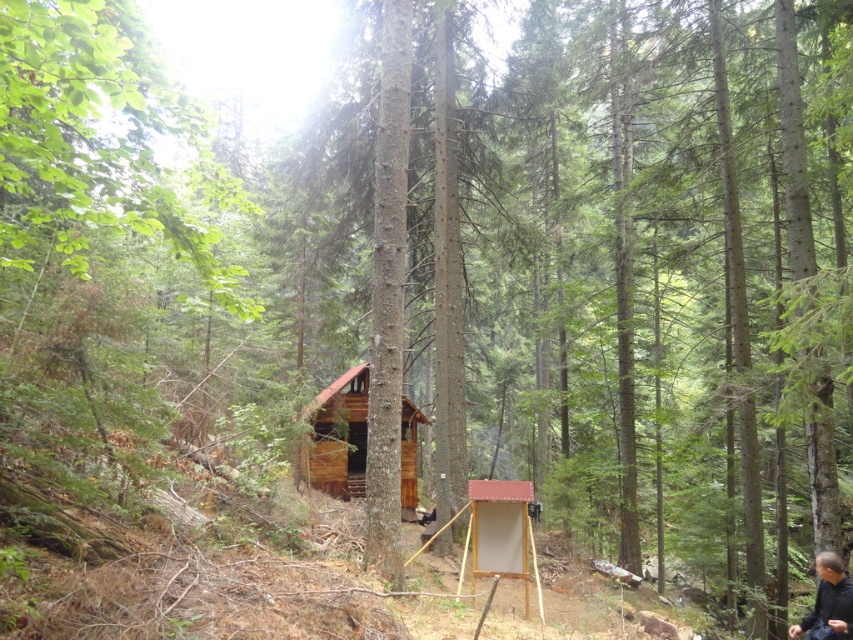
Who is positioned more to the right, white cardboard at center or dark brown leather jacket at lower right?

dark brown leather jacket at lower right is more to the right.

From the picture: Is white cardboard at center above dark brown leather jacket at lower right?

Indeed, white cardboard at center is positioned over dark brown leather jacket at lower right.

Is point (511, 493) closer to viewer compared to point (846, 620)?

No, (511, 493) is behind (846, 620).

Where is `white cardboard at center`? This screenshot has width=853, height=640. white cardboard at center is located at coordinates (502, 532).

Which of these two, brown wooden log cabin at center or dark brown leather jacket at lower right, stands taller?

brown wooden log cabin at center

Based on the photo, can you confirm if brown wooden log cabin at center is positioned to the right of dark brown leather jacket at lower right?

In fact, brown wooden log cabin at center is to the left of dark brown leather jacket at lower right.

I want to click on brown wooden log cabin at center, so click(339, 435).

Does brown wooden log cabin at center appear under white cardboard at center?

Indeed, brown wooden log cabin at center is positioned under white cardboard at center.

Measure the distance between brown wooden log cabin at center and camera.

The distance of brown wooden log cabin at center from camera is 62.46 feet.

This screenshot has width=853, height=640. Identify the location of brown wooden log cabin at center. (339, 435).

At what (x,y) coordinates should I click in order to perform the action: click on brown wooden log cabin at center. Please return your answer as a coordinate pair (x, y). Looking at the image, I should click on (339, 435).